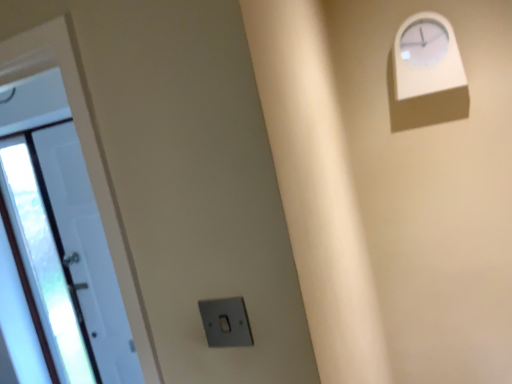
This screenshot has width=512, height=384. What do you see at coordinates (85, 159) in the screenshot?
I see `white glossy door at left` at bounding box center [85, 159].

What do you see at coordinates (426, 57) in the screenshot? I see `white plastic clock at upper right` at bounding box center [426, 57].

Describe the element at coordinates (226, 322) in the screenshot. Image resolution: width=512 pixels, height=384 pixels. I see `satin silver switch at lower center` at that location.

Find the location of a particular element. The width and height of the screenshot is (512, 384). white glossy door at left is located at coordinates (85, 159).

Looking at their sizes, would you say white plastic clock at upper right is wider or thinner than white glossy door at left?

Clearly, white plastic clock at upper right has more width compared to white glossy door at left.

Can you confirm if white plastic clock at upper right is positioned to the right of white glossy door at left?

Correct, you'll find white plastic clock at upper right to the right of white glossy door at left.

In terms of height, does white plastic clock at upper right look taller or shorter compared to white glossy door at left?

Answer: Considering their sizes, white plastic clock at upper right has less height than white glossy door at left.

Can you confirm if white plastic clock at upper right is bigger than white glossy door at left?

Incorrect, white plastic clock at upper right is not larger than white glossy door at left.

From the picture: From the image's perspective, is satin silver switch at lower center under white glossy door at left?

No.

Locate an element on the screen. The image size is (512, 384). door that appears on the left of satin silver switch at lower center is located at coordinates (85, 159).

Would you say satin silver switch at lower center is inside or outside white glossy door at left?

satin silver switch at lower center is outside white glossy door at left.

From a real-world perspective, is satin silver switch at lower center over white glossy door at left?

Correct, in the physical world, satin silver switch at lower center is higher than white glossy door at left.

From a real-world perspective, is white glossy door at left physically located above or below satin silver switch at lower center?

Clearly, from a real-world perspective, white glossy door at left is below satin silver switch at lower center.

Can you confirm if white glossy door at left is bigger than satin silver switch at lower center?

Yes.

Considering their positions, is white glossy door at left located in front of or behind satin silver switch at lower center?

white glossy door at left is behind satin silver switch at lower center.

How different are the orientations of white glossy door at left and satin silver switch at lower center in degrees?

The facing directions of white glossy door at left and satin silver switch at lower center are 1.56 degrees apart.

Consider the image. Considering the relative positions of satin silver switch at lower center and white plastic clock at upper right in the image provided, is satin silver switch at lower center behind white plastic clock at upper right?

No, it is not.

Considering the positions of points (245, 337) and (458, 49), is point (245, 337) closer to camera compared to point (458, 49)?

Yes.

Considering the relative sizes of satin silver switch at lower center and white plastic clock at upper right in the image provided, is satin silver switch at lower center thinner than white plastic clock at upper right?

Correct, the width of satin silver switch at lower center is less than that of white plastic clock at upper right.

Is satin silver switch at lower center to the left of white plastic clock at upper right from the viewer's perspective?

Yes.

Does white glossy door at left appear on the right side of white plastic clock at upper right?

No, white glossy door at left is not to the right of white plastic clock at upper right.

Considering the positions of point (27, 70) and point (450, 36), is point (27, 70) closer or farther from the camera than point (450, 36)?

Clearly, point (27, 70) is closer to the camera than point (450, 36).

What's the angular difference between white glossy door at left and white plastic clock at upper right's facing directions?

They differ by 0.137 degrees in their facing directions.

Considering the sizes of white glossy door at left and white plastic clock at upper right in the image, is white glossy door at left bigger or smaller than white plastic clock at upper right?

In the image, white glossy door at left appears to be larger than white plastic clock at upper right.

Is the position of white plastic clock at upper right more distant than that of satin silver switch at lower center?

Yes, white plastic clock at upper right is further from the viewer.

Which object is thinner, white plastic clock at upper right or satin silver switch at lower center?

satin silver switch at lower center is thinner.

Is white plastic clock at upper right in contact with satin silver switch at lower center?

white plastic clock at upper right and satin silver switch at lower center are not in contact.

Can you tell me how much white plastic clock at upper right and satin silver switch at lower center differ in facing direction?

The facing directions of white plastic clock at upper right and satin silver switch at lower center are 1.7 degrees apart.

Find the location of a particular element. The width and height of the screenshot is (512, 384). door lying on the left of white plastic clock at upper right is located at coordinates (85, 159).

I want to click on electric outlet in front of the white glossy door at left, so click(226, 322).

Based on their spatial positions, is satin silver switch at lower center or white plastic clock at upper right closer to white glossy door at left?

satin silver switch at lower center is closer to white glossy door at left.

From the image, which object appears to be nearer to white plastic clock at upper right, white glossy door at left or satin silver switch at lower center?

satin silver switch at lower center is closer to white plastic clock at upper right.

From the image, which object appears to be nearer to white glossy door at left, white plastic clock at upper right or satin silver switch at lower center?

satin silver switch at lower center is positioned closer to the anchor white glossy door at left.

Based on their spatial positions, is satin silver switch at lower center or white glossy door at left closer to white plastic clock at upper right?

The object closer to white plastic clock at upper right is satin silver switch at lower center.

From the image, which object appears to be farther from satin silver switch at lower center, white plastic clock at upper right or white glossy door at left?

Among the two, white plastic clock at upper right is located further to satin silver switch at lower center.

Looking at this image, based on their spatial positions, is white glossy door at left or white plastic clock at upper right closer to satin silver switch at lower center?

white glossy door at left.

This screenshot has height=384, width=512. I want to click on electric outlet between white glossy door at left and white plastic clock at upper right, so click(226, 322).